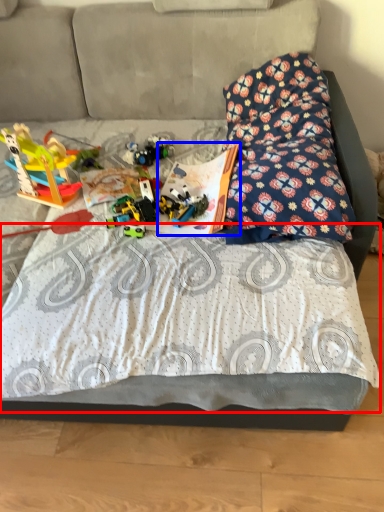
Question: Which object is further to the camera taking this photo, sheet (highlighted by a red box) or book (highlighted by a blue box)?

Choices:
 (A) sheet
 (B) book

Answer: (B)